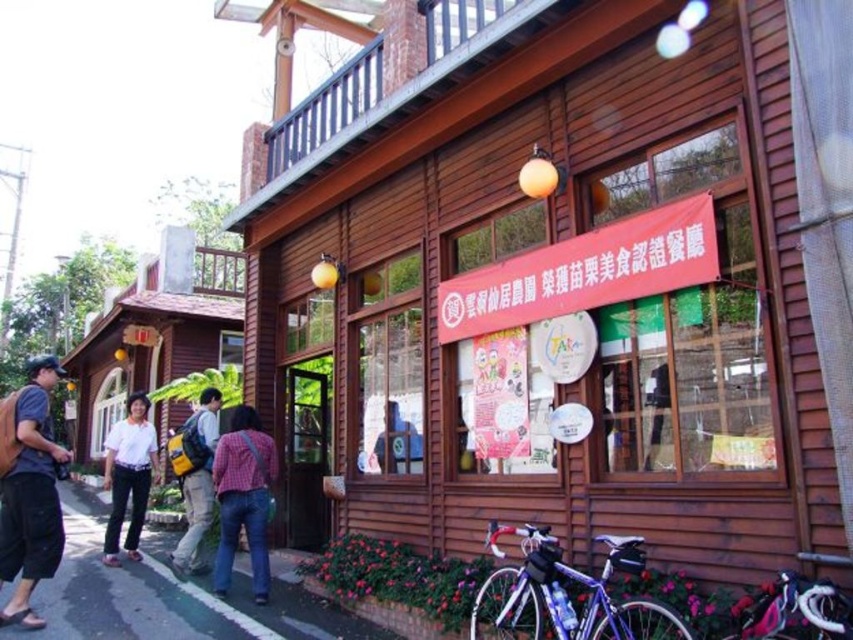
Question: Does wooden signboard at center come in front of dark blue denim shorts at lower left?

Choices:
 (A) yes
 (B) no

Answer: (A)

Question: Which of the following is the closest to the observer?

Choices:
 (A) (15, 412)
 (B) (492, 554)

Answer: (A)

Question: Which point is closer to the camera taking this photo?

Choices:
 (A) (790, 618)
 (B) (0, 573)
 (C) (154, 556)

Answer: (A)

Question: Which of the following is the farthest from the observer?

Choices:
 (A) coord(445,476)
 (B) coord(543,618)
 (C) coord(38,378)

Answer: (A)

Question: Does white shirt at center have a larger size compared to yellow backpack at center?

Choices:
 (A) yes
 (B) no

Answer: (B)

Question: Does wooden signboard at center have a lesser width compared to shiny purple bicycle at lower right?

Choices:
 (A) no
 (B) yes

Answer: (B)